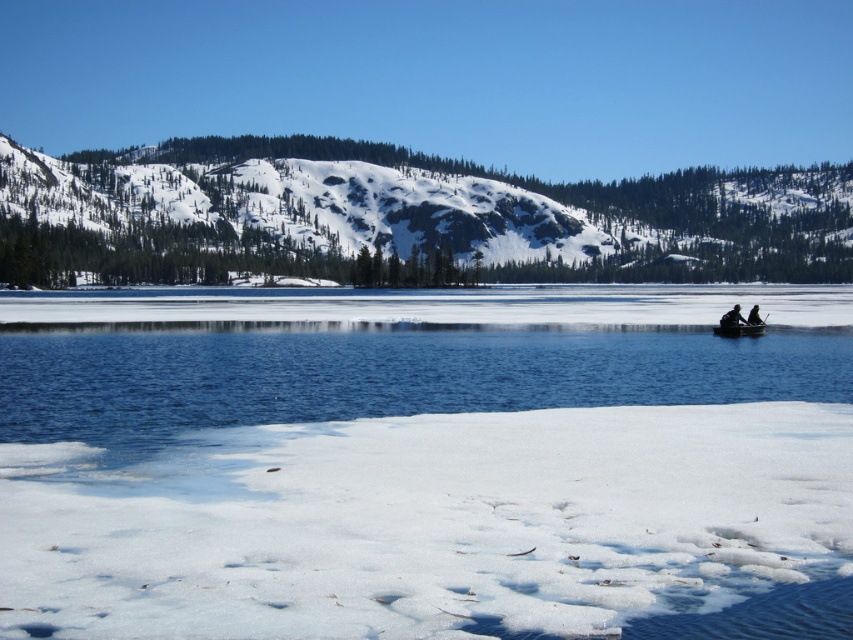
Question: Considering the real-world distances, which object is closest to the black fabric person at right?

Choices:
 (A) black plastic boat at right
 (B) white fluffy snow at lower center

Answer: (A)

Question: Does wooden canoe at center appear on the right side of black plastic boat at right?

Choices:
 (A) yes
 (B) no

Answer: (A)

Question: Which of the following is the closest to the observer?

Choices:
 (A) wooden canoe at center
 (B) black fabric person at right

Answer: (A)

Question: Which object is positioned farthest from the white fluffy snow at lower center?

Choices:
 (A) black fabric person at right
 (B) wooden canoe at center

Answer: (A)

Question: Is the position of black plastic boat at right more distant than that of black fabric person at right?

Choices:
 (A) yes
 (B) no

Answer: (B)

Question: Where is white fluffy snow at lower center located in relation to wooden canoe at center in the image?

Choices:
 (A) left
 (B) right

Answer: (A)